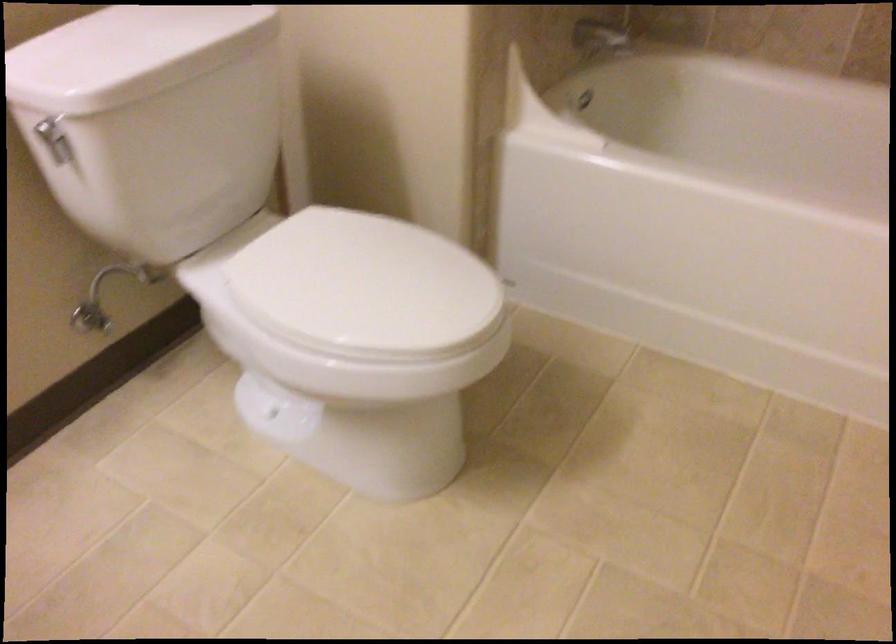
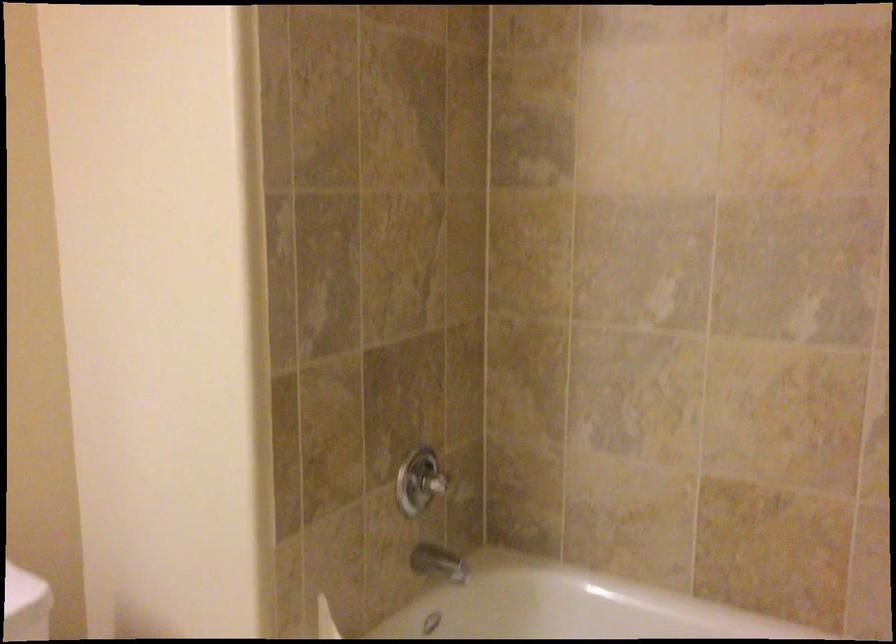
Question: The images are taken continuously from a first-person perspective. In which direction is your viewpoint rotating?

Choices:
 (A) Left
 (B) Right
 (C) Up
 (D) Down

Answer: (C)